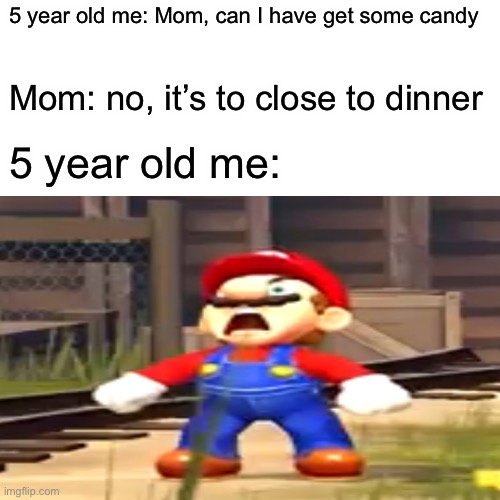
The height and width of the screenshot is (500, 500). Identify the location of shoe. (330, 454), (180, 443).